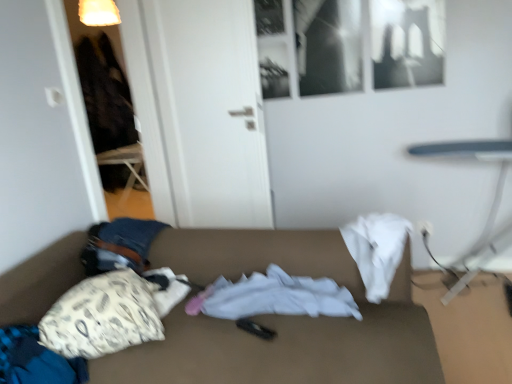
Describe the element at coordinates (490, 207) in the screenshot. I see `smooth white table at right` at that location.

At what (x,y) coordinates should I click in order to perform the action: click on smooth white table at right. Please return your answer as a coordinate pair (x, y). Looking at the image, I should click on (490, 207).

From the image's perspective, is white fabric pillow at lower left over white fabric couch at center?

Yes, from the image's perspective, white fabric pillow at lower left is above white fabric couch at center.

The image size is (512, 384). In order to click on studio couch in front of the white fabric pillow at lower left in this screenshot , I will do `click(279, 320)`.

Does white fabric pillow at lower left turn towards white fabric couch at center?

Yes, white fabric pillow at lower left is turned towards white fabric couch at center.

Is white fabric pillow at lower left at the left side of white fabric couch at center?

Yes, white fabric pillow at lower left is to the left of white fabric couch at center.

Considering the relative sizes of white fabric couch at center and white fabric at center in the image provided, is white fabric couch at center shorter than white fabric at center?

No.

Is white fabric couch at center to the left or to the right of white fabric at center in the image?

white fabric couch at center is to the left of white fabric at center.

Considering the relative sizes of white fabric couch at center and white fabric at center in the image provided, is white fabric couch at center smaller than white fabric at center?

No.

Which of these two, white fabric couch at center or white fabric at center, is thinner?

white fabric at center is thinner.

Does white fabric couch at center turn towards white fabric pillow at lower left?

Yes.

Does white fabric couch at center have a larger size compared to white fabric pillow at lower left?

Yes, white fabric couch at center is bigger than white fabric pillow at lower left.

Considering the relative sizes of white fabric couch at center and white fabric pillow at lower left in the image provided, is white fabric couch at center taller than white fabric pillow at lower left?

Indeed, white fabric couch at center has a greater height compared to white fabric pillow at lower left.

From a real-world perspective, is white fabric couch at center physically below white fabric pillow at lower left?

Yes.

Does point (476, 152) come behind point (247, 108)?

No, it is not.

From a real-world perspective, between smooth white table at right and white glossy door at center, who is vertically lower?

smooth white table at right, from a real-world perspective.

Visually, is smooth white table at right positioned to the left or to the right of white glossy door at center?

Clearly, smooth white table at right is on the right of white glossy door at center in the image.

Is white fabric at center positioned behind white glossy door at center?

No.

Is white fabric at center far away from white glossy door at center?

Indeed, white fabric at center is not near white glossy door at center.

Is white glossy door at center at the back of white fabric at center?

That's not correct — white fabric at center is not looking away from white glossy door at center.

From the image's perspective, which is below, white fabric pillow at lower left or smooth white table at right?

white fabric pillow at lower left is shown below in the image.

Locate an element on the screen. The height and width of the screenshot is (384, 512). throw pillow lying below the smooth white table at right (from the image's perspective) is located at coordinates (105, 315).

Would you say white fabric pillow at lower left is inside or outside smooth white table at right?

The correct answer is: outside.

Is smooth white table at right situated inside white fabric couch at center or outside?

smooth white table at right is not inside white fabric couch at center, it's outside.

Does smooth white table at right have a smaller size compared to white fabric couch at center?

Indeed, smooth white table at right has a smaller size compared to white fabric couch at center.

Could you tell me if smooth white table at right is turned towards white fabric couch at center?

No, smooth white table at right is not oriented towards white fabric couch at center.

Find the location of a particular element. Image resolution: width=512 pixels, height=384 pixels. throw pillow above the white fabric couch at center (from a real-world perspective) is located at coordinates [x=105, y=315].

Find the location of a particular element. The width and height of the screenshot is (512, 384). studio couch in front of the white fabric at center is located at coordinates (279, 320).

Based on their spatial positions, is white fabric pillow at lower left or white fabric at center further from white glossy door at center?

white fabric pillow at lower left.

Which object lies nearer to the anchor point white fabric pillow at lower left, smooth white table at right or white fabric couch at center?

white fabric couch at center is closer to white fabric pillow at lower left.

Estimate the real-world distances between objects in this image. Which object is closer to white fabric couch at center, smooth white table at right or white fabric pillow at lower left?

white fabric pillow at lower left is positioned closer to the anchor white fabric couch at center.

Based on their spatial positions, is white glossy door at center or smooth white table at right further from white fabric couch at center?

smooth white table at right is positioned further to the anchor white fabric couch at center.

Which object lies nearer to the anchor point smooth white table at right, white fabric pillow at lower left or white fabric couch at center?

The object closer to smooth white table at right is white fabric couch at center.

In the scene shown: Estimate the real-world distances between objects in this image. Which object is closer to white glossy door at center, white fabric at center or white fabric couch at center?

Based on the image, white fabric couch at center appears to be nearer to white glossy door at center.

Based on their spatial positions, is smooth white table at right or white fabric at center further from white fabric couch at center?

smooth white table at right lies further to white fabric couch at center than the other object.

From the image, which object appears to be farther from white fabric couch at center, white fabric at center or smooth white table at right?

Among the two, smooth white table at right is located further to white fabric couch at center.

This screenshot has height=384, width=512. I want to click on sheet positioned between white fabric couch at center and white glossy door at center from near to far, so click(278, 296).

Where is `throw pillow between white fabric couch at center and white glossy door at center in the front-back direction`? This screenshot has height=384, width=512. throw pillow between white fabric couch at center and white glossy door at center in the front-back direction is located at coordinates (105, 315).

This screenshot has height=384, width=512. Identify the location of studio couch situated between white fabric pillow at lower left and smooth white table at right from left to right. pos(279,320).

Find the location of a particular element. The height and width of the screenshot is (384, 512). sheet between white glossy door at center and smooth white table at right from left to right is located at coordinates (278, 296).